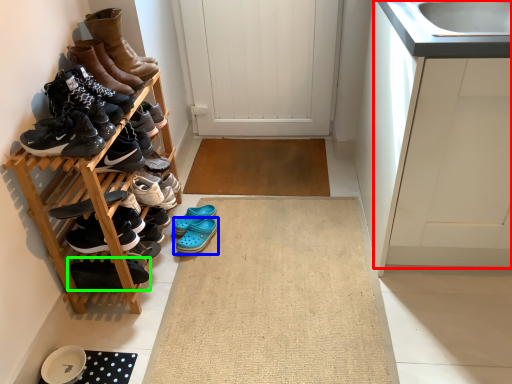
Question: Which is farther away from cabinetry (highlighted by a red box)? footwear (highlighted by a blue box) or footwear (highlighted by a green box)?

Choices:
 (A) footwear
 (B) footwear

Answer: (B)